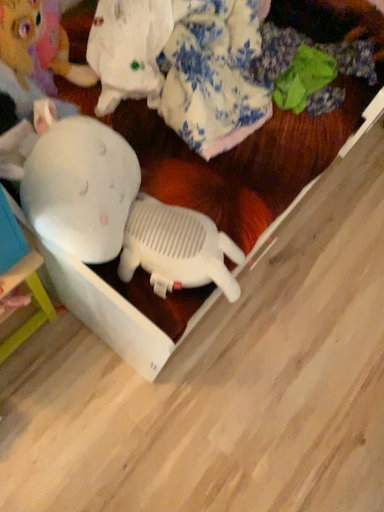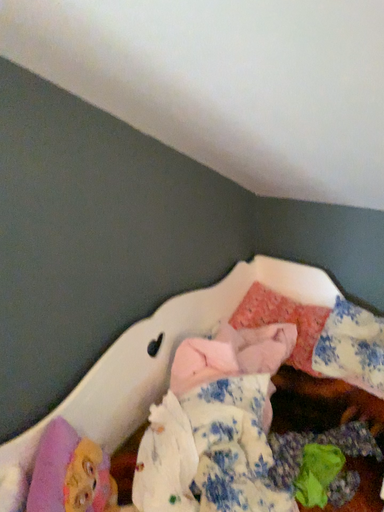
Question: How did the camera likely rotate when shooting the video?

Choices:
 (A) rotated left
 (B) rotated right

Answer: (A)